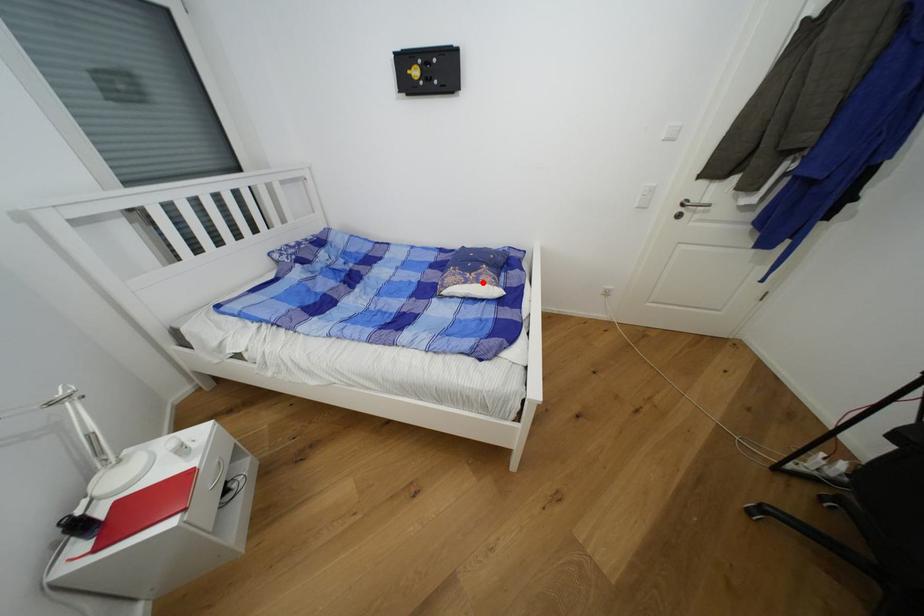
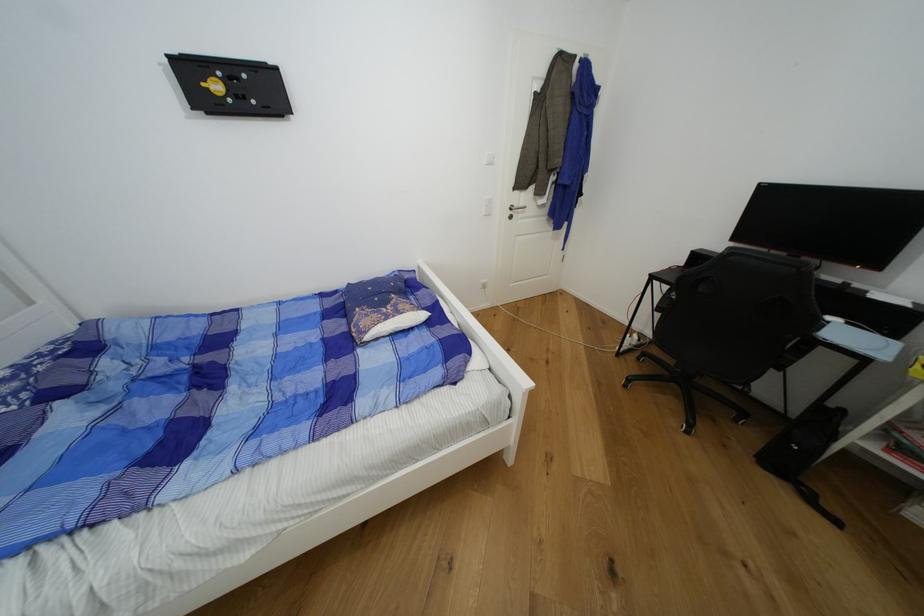
Where in the second image is the point corresponding to the highlighted location from the first image?

(404, 314)